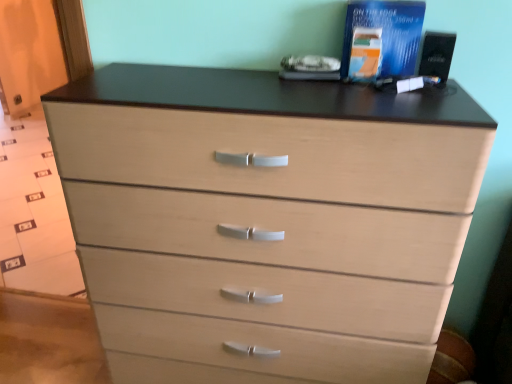
Question: Visually, is blue matte book at upper right, which is the 2th book from left to right, positioned to the left or to the right of blue paper at upper right, the second book in the right-to-left sequence?

Choices:
 (A) right
 (B) left

Answer: (A)

Question: Do you think blue matte book at upper right, which is the 2th book from left to right, is within blue paper at upper right, the second book in the right-to-left sequence, or outside of it?

Choices:
 (A) inside
 (B) outside

Answer: (B)

Question: Considering the positions of blue matte book at upper right, the first book positioned from the right, and blue paper at upper right, the second book in the right-to-left sequence, in the image, is blue matte book at upper right, the first book positioned from the right, bigger or smaller than blue paper at upper right, the second book in the right-to-left sequence,?

Choices:
 (A) big
 (B) small

Answer: (A)

Question: Do you think blue paper at upper right, the second book in the right-to-left sequence, is within blue matte book at upper right, which is the 2th book from left to right, or outside of it?

Choices:
 (A) inside
 (B) outside

Answer: (B)

Question: Is point (357, 46) closer or farther from the camera than point (389, 21)?

Choices:
 (A) closer
 (B) farther

Answer: (B)

Question: From the image's perspective, is blue paper at upper right, the second book in the right-to-left sequence, located above or below blue matte book at upper right, which is the 2th book from left to right?

Choices:
 (A) above
 (B) below

Answer: (B)

Question: Relative to blue matte book at upper right, the first book positioned from the right, is blue paper at upper right, the first book from the left, in front or behind?

Choices:
 (A) behind
 (B) front

Answer: (A)